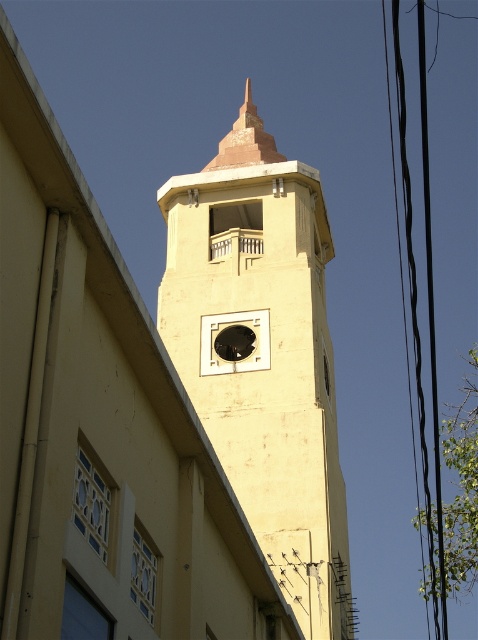
Can you confirm if yellow matte clock tower at center is positioned above black rubber power lines at right?

Correct, yellow matte clock tower at center is located above black rubber power lines at right.

Does yellow matte clock tower at center have a lesser height compared to black rubber power lines at right?

Correct, yellow matte clock tower at center is not as tall as black rubber power lines at right.

Is point (258, 212) positioned behind point (428, 618)?

No.

Where is `yellow matte clock tower at center`? The width and height of the screenshot is (478, 640). yellow matte clock tower at center is located at coordinates (262, 356).